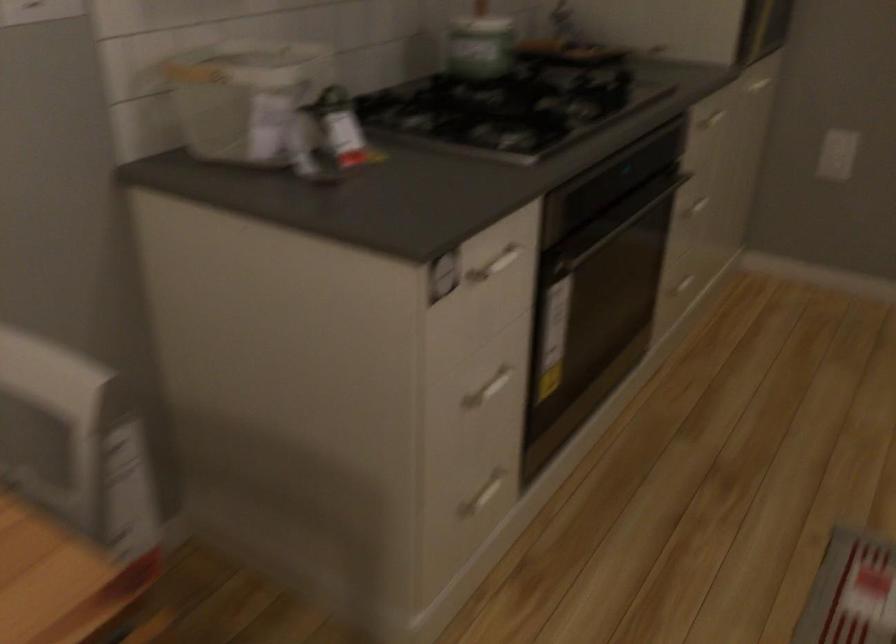
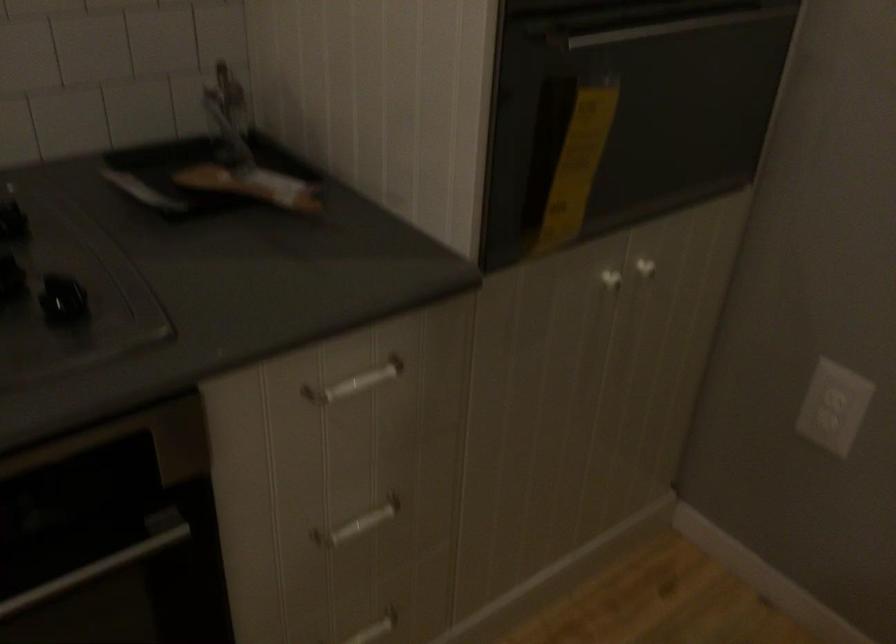
In the second image, find the point that corresponds to point (685, 286) in the first image.

(374, 629)